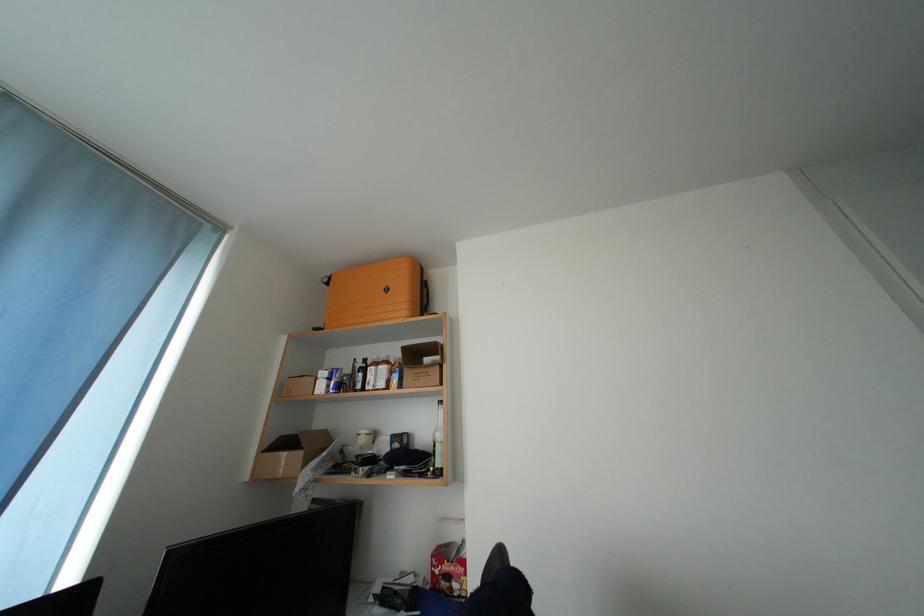
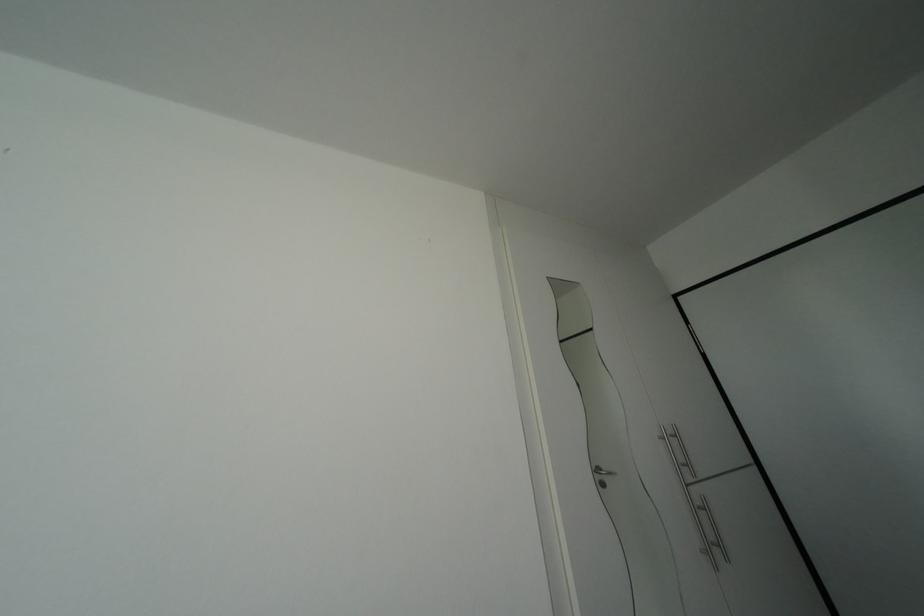
Question: The images are taken continuously from a first-person perspective. In which direction is your viewpoint rotating?

Choices:
 (A) Left
 (B) Right
 (C) Up
 (D) Down

Answer: (B)